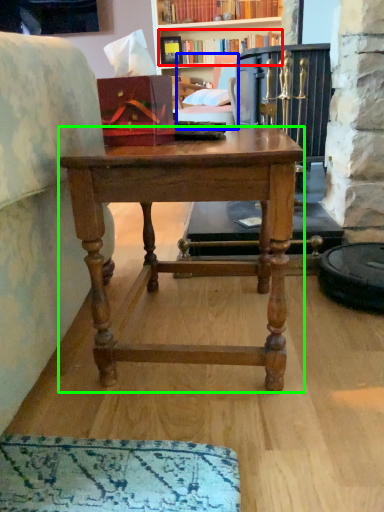
Question: Considering the real-world distances, which object is farthest from book (highlighted by a red box)? swivel chair (highlighted by a blue box) or desk (highlighted by a green box)?

Choices:
 (A) swivel chair
 (B) desk

Answer: (B)